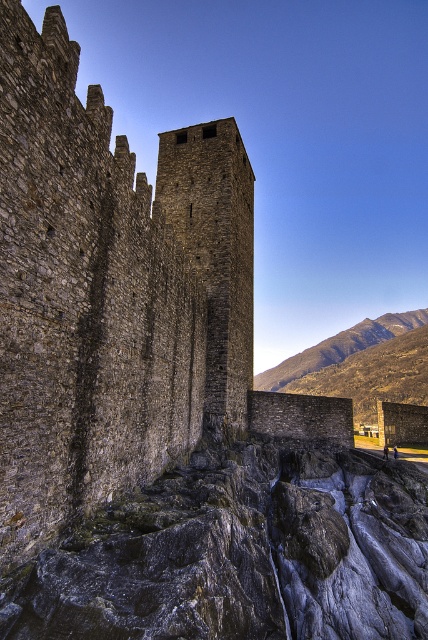
Does gray stone waterfall at lower center appear on the left side of dark gray stone tower at center?

In fact, gray stone waterfall at lower center is to the right of dark gray stone tower at center.

Which is behind, point (166, 612) or point (226, 305)?

Point (226, 305)

Where is `gray stone waterfall at lower center`? The width and height of the screenshot is (428, 640). gray stone waterfall at lower center is located at coordinates (240, 554).